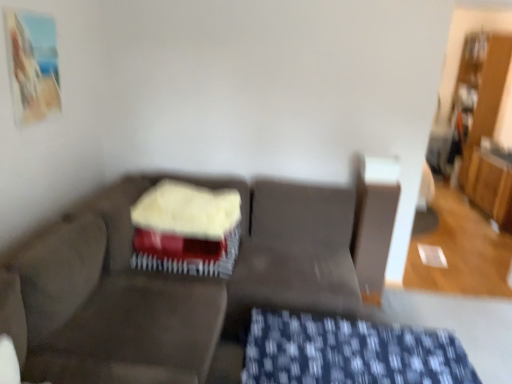
The width and height of the screenshot is (512, 384). What do you see at coordinates (349, 352) in the screenshot? I see `blue textured fabric at lower center` at bounding box center [349, 352].

Identify the location of blue textured fabric at lower center. [x=349, y=352].

What is the approximate width of dark gray fabric couch at center?

It is 5.51 feet.

Measure the distance between point (19,337) and camera.

Point (19,337) is 1.58 meters from camera.

At what (x,y) coordinates should I click in order to perform the action: click on blue textured fabric at lower center. Please return your answer as a coordinate pair (x, y). The image size is (512, 384). Looking at the image, I should click on (349, 352).

Who is taller, blue textured fabric at lower center or dark gray fabric couch at center?

Standing taller between the two is dark gray fabric couch at center.

Can you tell me how much blue textured fabric at lower center and dark gray fabric couch at center differ in facing direction?

The angle between the facing direction of blue textured fabric at lower center and the facing direction of dark gray fabric couch at center is 0.000171 degrees.

Between point (265, 351) and point (85, 255), which one is positioned behind?

The point (85, 255) is behind.

From a real-world perspective, which object rests below the other?

blue textured fabric at lower center, from a real-world perspective.

Is velvet-like beige swivel chair at center looking in the opposite direction of dark gray fabric couch at center?

Correct, velvet-like beige swivel chair at center is looking away from dark gray fabric couch at center.

From the image's perspective, which is above, velvet-like beige swivel chair at center or dark gray fabric couch at center?

dark gray fabric couch at center.

Measure the distance from velvet-like beige swivel chair at center to dark gray fabric couch at center.

6.89 inches.

Is velvet-like beige swivel chair at center at the right side of dark gray fabric couch at center?

In fact, velvet-like beige swivel chair at center is to the left of dark gray fabric couch at center.

Does smooth red cake at center lie in front of blue textured fabric at lower center?

No, smooth red cake at center is further to the viewer.

I want to click on cake that appears above the blue textured fabric at lower center (from the image's perspective), so pyautogui.click(x=186, y=229).

Considering the relative sizes of smooth red cake at center and blue textured fabric at lower center in the image provided, is smooth red cake at center bigger than blue textured fabric at lower center?

No, smooth red cake at center is not bigger than blue textured fabric at lower center.

Considering the relative sizes of smooth red cake at center and blue textured fabric at lower center in the image provided, is smooth red cake at center thinner than blue textured fabric at lower center?

Yes.

From the image's perspective, between blue textured fabric at lower center and velvet-like beige swivel chair at center, which one is located above?

velvet-like beige swivel chair at center appears higher in the image.

Would you say blue textured fabric at lower center is a long distance from velvet-like beige swivel chair at center?

They are positioned close to each other.

Locate an element on the screen. This screenshot has height=384, width=512. tablecloth to the right of velvet-like beige swivel chair at center is located at coordinates (349, 352).

Could you tell me if blue textured fabric at lower center is turned towards velvet-like beige swivel chair at center?

No, blue textured fabric at lower center is not aimed at velvet-like beige swivel chair at center.

Where is `tablecloth located below the smooth red cake at center (from the image's perspective)`? This screenshot has width=512, height=384. tablecloth located below the smooth red cake at center (from the image's perspective) is located at coordinates (349, 352).

Measure the distance from blue textured fabric at lower center to smooth red cake at center.

blue textured fabric at lower center is 28.75 inches from smooth red cake at center.

From a real-world perspective, is blue textured fabric at lower center positioned above or below smooth red cake at center?

In terms of real-world spatial position, blue textured fabric at lower center is below smooth red cake at center.

From the image's perspective, which object appears higher, blue textured fabric at lower center or smooth red cake at center?

smooth red cake at center appears higher in the image.

Considering their positions, is velvet-like beige swivel chair at center located in front of or behind blue textured fabric at lower center?

velvet-like beige swivel chair at center is in front of blue textured fabric at lower center.

Between velvet-like beige swivel chair at center and blue textured fabric at lower center, which one has less height?

blue textured fabric at lower center.

Is velvet-like beige swivel chair at center oriented away from blue textured fabric at lower center?

No, velvet-like beige swivel chair at center is not facing the opposite direction of blue textured fabric at lower center.

Locate an element on the screen. tablecloth lying below the velvet-like beige swivel chair at center (from the image's perspective) is located at coordinates (349, 352).

Is dark gray fabric couch at center turned away from velvet-like beige swivel chair at center?

Yes, dark gray fabric couch at center is facing away from velvet-like beige swivel chair at center.

Considering their positions, is dark gray fabric couch at center located in front of or behind velvet-like beige swivel chair at center?

Clearly, dark gray fabric couch at center is in front of velvet-like beige swivel chair at center.

From the picture: Considering the relative sizes of dark gray fabric couch at center and velvet-like beige swivel chair at center in the image provided, is dark gray fabric couch at center bigger than velvet-like beige swivel chair at center?

Yes.

Where is `studio couch that appears above the blue textured fabric at lower center (from a real-world perspective)`? studio couch that appears above the blue textured fabric at lower center (from a real-world perspective) is located at coordinates (188, 278).

The width and height of the screenshot is (512, 384). I want to click on studio couch on the right side of velvet-like beige swivel chair at center, so click(x=188, y=278).

Estimate the real-world distances between objects in this image. Which object is closer to smooth red cake at center, dark gray fabric couch at center or velvet-like beige swivel chair at center?

Based on the image, dark gray fabric couch at center appears to be nearer to smooth red cake at center.

Based on their spatial positions, is velvet-like beige swivel chair at center or blue textured fabric at lower center closer to smooth red cake at center?

velvet-like beige swivel chair at center lies closer to smooth red cake at center than the other object.

When comparing their distances from velvet-like beige swivel chair at center, does smooth red cake at center or blue textured fabric at lower center seem closer?

Based on the image, smooth red cake at center appears to be nearer to velvet-like beige swivel chair at center.

When comparing their distances from velvet-like beige swivel chair at center, does dark gray fabric couch at center or blue textured fabric at lower center seem further?

Among the two, blue textured fabric at lower center is located further to velvet-like beige swivel chair at center.

Considering their positions, is blue textured fabric at lower center positioned closer to smooth red cake at center than dark gray fabric couch at center?

Among the two, dark gray fabric couch at center is located nearer to smooth red cake at center.

Estimate the real-world distances between objects in this image. Which object is further from smooth red cake at center, dark gray fabric couch at center or blue textured fabric at lower center?

blue textured fabric at lower center.

Estimate the real-world distances between objects in this image. Which object is further from dark gray fabric couch at center, blue textured fabric at lower center or velvet-like beige swivel chair at center?

blue textured fabric at lower center is positioned further to the anchor dark gray fabric couch at center.

From the image, which object appears to be farther from dark gray fabric couch at center, blue textured fabric at lower center or smooth red cake at center?

Among the two, blue textured fabric at lower center is located further to dark gray fabric couch at center.

This screenshot has height=384, width=512. Identify the location of studio couch located between velvet-like beige swivel chair at center and blue textured fabric at lower center in the left-right direction. (188, 278).

Find the location of a particular element. The image size is (512, 384). swivel chair located between dark gray fabric couch at center and smooth red cake at center in the depth direction is located at coordinates (109, 316).

Find the location of a particular element. tablecloth between velvet-like beige swivel chair at center and smooth red cake at center along the z-axis is located at coordinates (349, 352).

Locate an element on the screen. This screenshot has width=512, height=384. tablecloth located between dark gray fabric couch at center and smooth red cake at center in the depth direction is located at coordinates (349, 352).